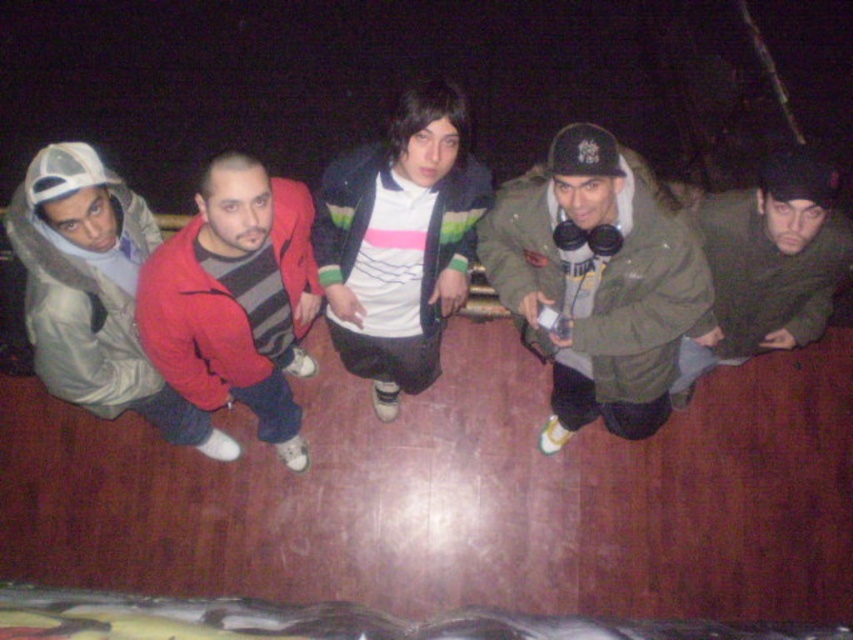
Question: Which of the following is the closest to the observer?

Choices:
 (A) (257, 280)
 (B) (820, 182)
 (C) (572, 157)

Answer: (C)

Question: Is white striped shirt at center smaller than dark gray knit sweater at center?

Choices:
 (A) yes
 (B) no

Answer: (B)

Question: Is the position of red matte sweater at center less distant than that of light gray hooded sweatshirt at left?

Choices:
 (A) no
 (B) yes

Answer: (B)

Question: In this image, where is white striped shirt at center located relative to red matte sweater at center?

Choices:
 (A) right
 (B) left

Answer: (A)

Question: Which point is closer to the camera taking this photo?

Choices:
 (A) (665, 304)
 (B) (737, 320)
 (C) (294, 248)

Answer: (A)

Question: Estimate the real-world distances between objects in this image. Which object is closer to the white striped shirt at center?

Choices:
 (A) dark gray knit sweater at center
 (B) green matte jacket at center

Answer: (B)